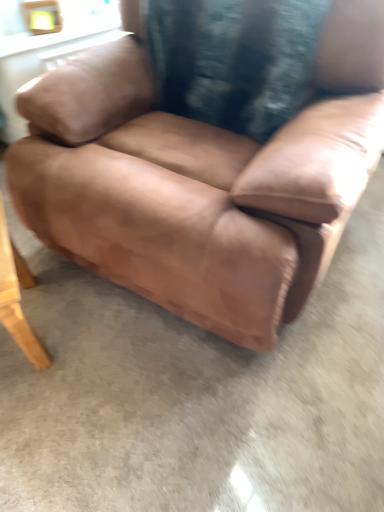
Identify the location of free spot in front of brown leather chair at center. The height and width of the screenshot is (512, 384). (200, 404).